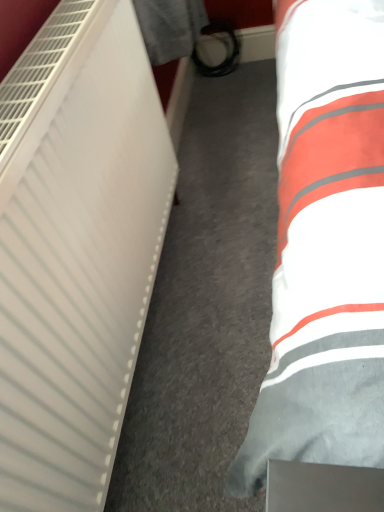
Identify the location of vacant region to the right of white matte radiator at left. (222, 280).